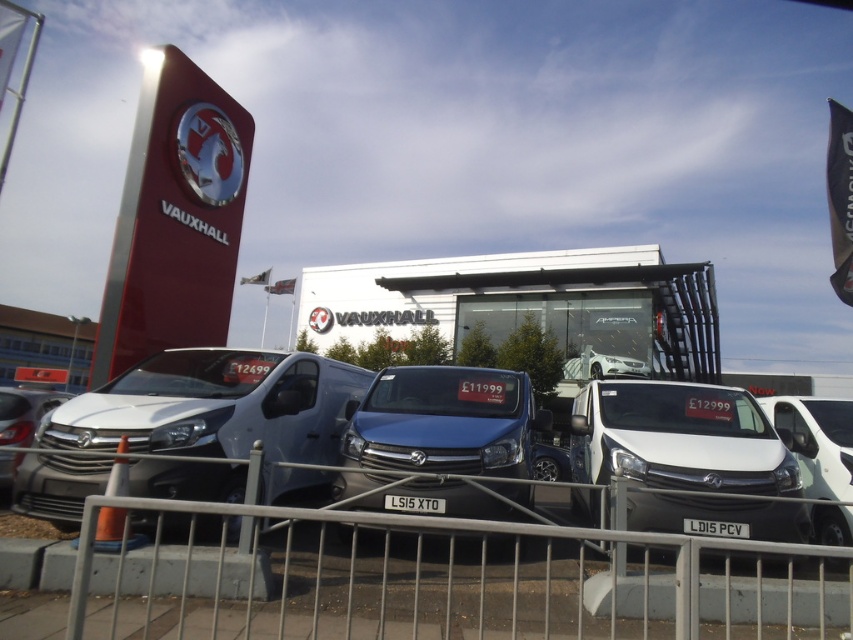
Question: Does metallic gray fence at center come behind white glossy van at center?

Choices:
 (A) no
 (B) yes

Answer: (A)

Question: Does white glossy van at center have a smaller size compared to white matte van at center?

Choices:
 (A) no
 (B) yes

Answer: (A)

Question: Which point is closer to the camera taking this photo?

Choices:
 (A) (621, 548)
 (B) (55, 432)
 (C) (712, 532)
 (D) (839, 529)

Answer: (A)

Question: Which of the following is the farthest from the observer?

Choices:
 (A) (646, 422)
 (B) (521, 492)
 (C) (332, 550)

Answer: (A)

Question: Estimate the real-world distances between objects in this image. Which object is farther from the white glossy van at center?

Choices:
 (A) white matte van at center
 (B) matte silver van at center

Answer: (B)

Question: Considering the relative positions of metallic gray fence at center and white matte van at center in the image provided, where is metallic gray fence at center located with respect to white matte van at center?

Choices:
 (A) left
 (B) right

Answer: (A)